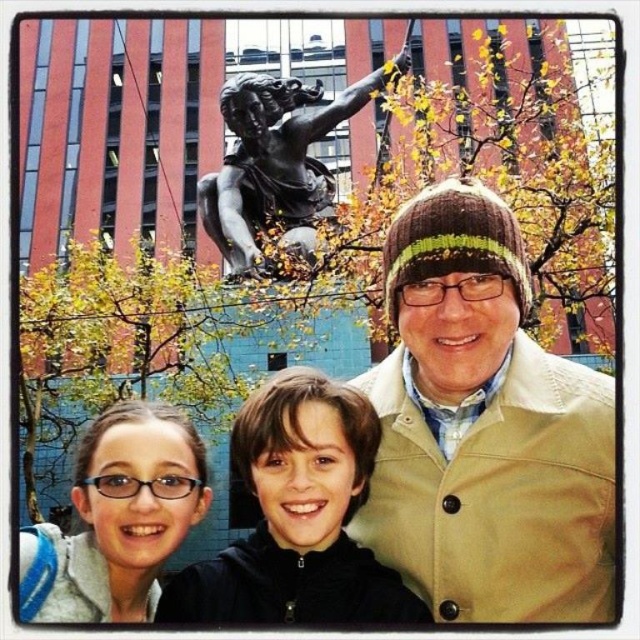
Question: Which of these objects is positioned farthest from the matte gray backpack at lower left?

Choices:
 (A) brown knit cap at upper right
 (B) bronze statue at upper center
 (C) black matte jacket at center

Answer: (B)

Question: Does brown knit cap at upper right appear under matte gray backpack at lower left?

Choices:
 (A) yes
 (B) no

Answer: (B)

Question: Is brown knit cap at upper right in front of black matte jacket at center?

Choices:
 (A) yes
 (B) no

Answer: (B)

Question: Estimate the real-world distances between objects in this image. Which object is closer to the matte gray backpack at lower left?

Choices:
 (A) brown knit cap at upper right
 (B) black matte jacket at center

Answer: (B)

Question: Can you confirm if black matte jacket at center is wider than matte gray backpack at lower left?

Choices:
 (A) no
 (B) yes

Answer: (B)

Question: Which point is closer to the camera?

Choices:
 (A) (284, 474)
 (B) (104, 492)

Answer: (A)